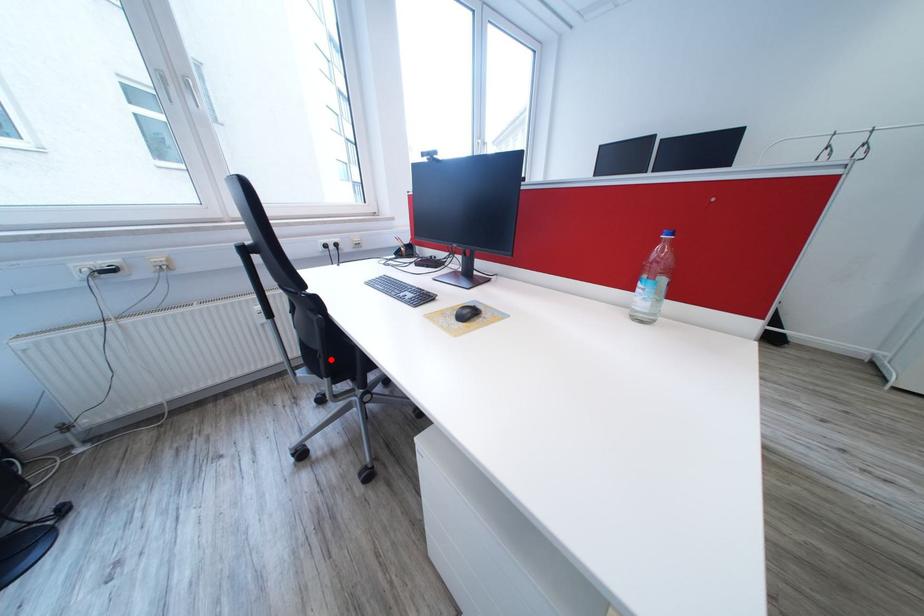
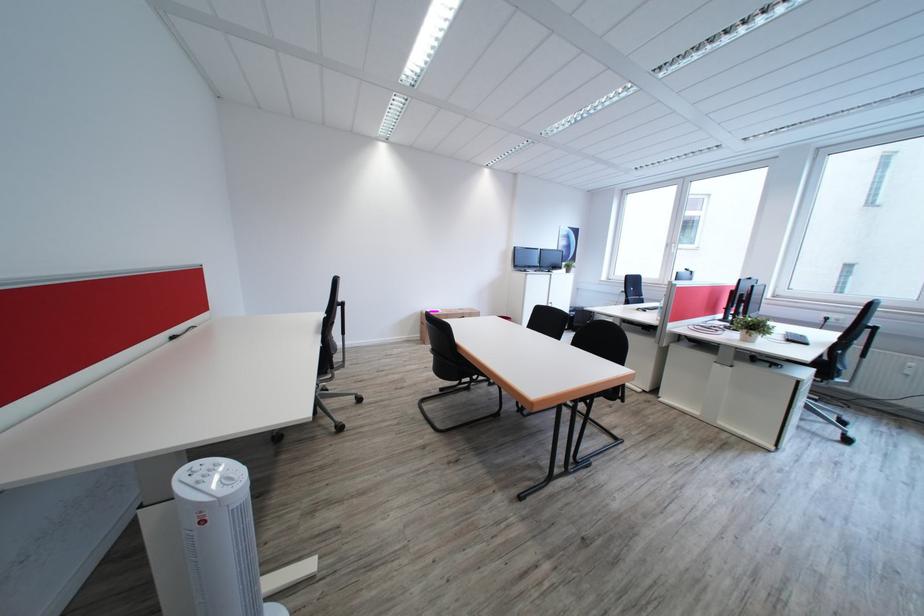
Question: I am providing you with two images of the same scene from different viewpoints. A red point is marked on the first image. Is the red point's position out of view in image 2?

Choices:
 (A) Yes
 (B) No

Answer: (A)